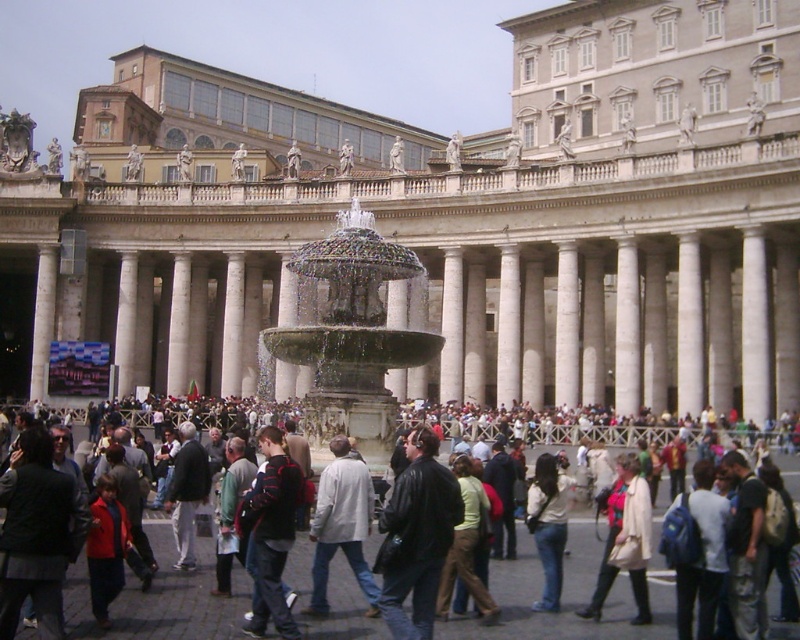
You are standing in St. Peter Square and see a leather jacket at center and a light gray coat at center. Which one is on the right side?

The leather jacket at center is on the right side of the light gray coat at center.

You are a tourist standing in St. Peter Square. You see the white marble palace at center and jeans at center. Which one is taller?

The white marble palace at center is taller than the jeans at center.